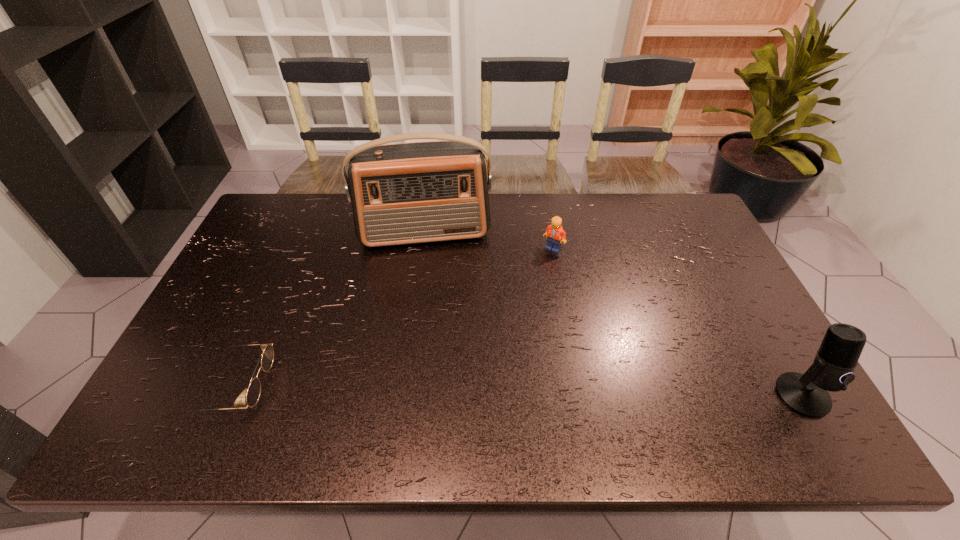
Find the location of a particular element. This screenshot has height=540, width=960. blank space located 0.060m on the front-facing side of the third tallest object is located at coordinates (549, 266).

At what (x,y) coordinates should I click in order to perform the action: click on vacant space located on the front-facing side of the third tallest object. Please return your answer as a coordinate pair (x, y). Image resolution: width=960 pixels, height=540 pixels. Looking at the image, I should click on (548, 271).

Find the location of a particular element. Image resolution: width=960 pixels, height=540 pixels. free space located 0.400m on the front-facing side of the tallest object is located at coordinates (441, 356).

Locate an element on the screen. The height and width of the screenshot is (540, 960). free point located 0.250m on the front-facing side of the tallest object is located at coordinates (437, 312).

You are a GUI agent. You are given a task and a screenshot of the screen. Output one action in this format:
    pyautogui.click(x=<x>, y=<y>)
    Task: Click on the free space located 0.320m on the front-facing side of the tallest object
    The height and width of the screenshot is (540, 960).
    Given the screenshot: What is the action you would take?
    pyautogui.click(x=439, y=331)

Identify the location of object located at the far edge. Image resolution: width=960 pixels, height=540 pixels. (419, 192).

Locate an element on the screen. sunglasses that is at the near edge is located at coordinates (253, 393).

Identify the location of microphone that is at the near edge. (832, 370).

Locate an element on the screen. The width and height of the screenshot is (960, 540). object situated at the left edge is located at coordinates (253, 393).

What are the coordinates of `object positioned at the right edge` in the screenshot? It's located at (832, 370).